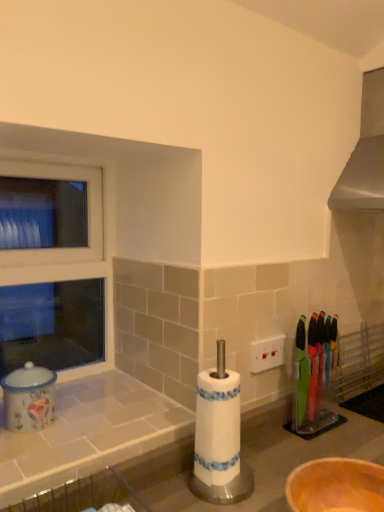
Measure the distance between white tile counter at lower left and camera.

The distance of white tile counter at lower left from camera is 29.96 inches.

What is the approximate width of wooden bowl at lower right?

7.51 inches.

Measure the distance between matte ceramic coffee canister at left and camera.

matte ceramic coffee canister at left is 37.74 inches away from camera.

Locate an element on the screen. The height and width of the screenshot is (512, 384). translucent plastic knives at right is located at coordinates (309, 382).

Identify the location of white tile counter at lower left. (88, 433).

Is matte ceramic coffee canister at left in contact with white tile counter at lower left?

No, matte ceramic coffee canister at left is not making contact with white tile counter at lower left.

Considering the relative sizes of matte ceramic coffee canister at left and white tile counter at lower left in the image provided, is matte ceramic coffee canister at left wider than white tile counter at lower left?

No, matte ceramic coffee canister at left is not wider than white tile counter at lower left.

Does matte ceramic coffee canister at left appear on the right side of white tile counter at lower left?

No.

The height and width of the screenshot is (512, 384). In order to click on appliance above the white tile counter at lower left (from the image's perspective) in this screenshot , I will do `click(29, 398)`.

I want to click on bowl on the left of translucent plastic knives at right, so click(x=336, y=486).

Is wooden bowl at lower right next to translucent plastic knives at right and touching it?

There is a gap between wooden bowl at lower right and translucent plastic knives at right.

Does wooden bowl at lower right lie in front of translucent plastic knives at right?

Yes, wooden bowl at lower right is in front of translucent plastic knives at right.

Is wooden bowl at lower right facing away from translucent plastic knives at right?

No, wooden bowl at lower right is not facing away from translucent plastic knives at right.

From their relative heights in the image, would you say translucent plastic knives at right is taller or shorter than matte ceramic coffee canister at left?

Considering their sizes, translucent plastic knives at right has more height than matte ceramic coffee canister at left.

From the image's perspective, which one is positioned lower, translucent plastic knives at right or matte ceramic coffee canister at left?

matte ceramic coffee canister at left appears lower in the image.

In the image, is translucent plastic knives at right positioned in front of or behind matte ceramic coffee canister at left?

Clearly, translucent plastic knives at right is behind matte ceramic coffee canister at left.

Does translucent plastic knives at right appear on the right side of matte ceramic coffee canister at left?

Correct, you'll find translucent plastic knives at right to the right of matte ceramic coffee canister at left.

Which of these two, translucent plastic knives at right or white tile counter at lower left, is bigger?

white tile counter at lower left is bigger.

From a real-world perspective, between translucent plastic knives at right and white tile counter at lower left, who is vertically higher?

In real-world perspective, translucent plastic knives at right is above.

Which of these two, translucent plastic knives at right or white tile counter at lower left, stands shorter?

With less height is white tile counter at lower left.

Is translucent plastic knives at right inside the boundaries of white tile counter at lower left, or outside?

translucent plastic knives at right is not inside white tile counter at lower left, it's outside.

Which is behind, wooden bowl at lower right or matte ceramic coffee canister at left?

matte ceramic coffee canister at left is further away from the camera.

Is point (382, 504) less distant than point (16, 420)?

Yes, it is in front of point (16, 420).

From a real-world perspective, is wooden bowl at lower right physically below matte ceramic coffee canister at left?

Yes, from a real-world perspective, wooden bowl at lower right is under matte ceramic coffee canister at left.

Which object is wider, wooden bowl at lower right or matte ceramic coffee canister at left?

wooden bowl at lower right.

Looking at this image, which object is positioned more to the right, translucent plastic knives at right or wooden bowl at lower right?

translucent plastic knives at right.

Which object is thinner, translucent plastic knives at right or wooden bowl at lower right?

With smaller width is translucent plastic knives at right.

In the scene shown: Is wooden bowl at lower right at the back of translucent plastic knives at right?

That's not correct — translucent plastic knives at right is not looking away from wooden bowl at lower right.

From a real-world perspective, is wooden bowl at lower right under white tile counter at lower left?

Correct, in the physical world, wooden bowl at lower right is lower than white tile counter at lower left.

Based on the photo, in the image, is wooden bowl at lower right on the left side or the right side of white tile counter at lower left?

wooden bowl at lower right is to the right of white tile counter at lower left.

Between wooden bowl at lower right and white tile counter at lower left, which one has larger width?

white tile counter at lower left.

Looking at this image, from the image's perspective, which is above, wooden bowl at lower right or white tile counter at lower left?

white tile counter at lower left appears higher in the image.

The width and height of the screenshot is (384, 512). What are the coordinates of `appliance behind the white tile counter at lower left` in the screenshot? It's located at (29, 398).

At what (x,y) coordinates should I click in order to perform the action: click on tableware that is on the right side of wooden bowl at lower right. Please return your answer as a coordinate pair (x, y). The height and width of the screenshot is (512, 384). Looking at the image, I should click on (309, 382).

When comparing their distances from wooden bowl at lower right, does matte ceramic coffee canister at left or translucent plastic knives at right seem further?

matte ceramic coffee canister at left is further to wooden bowl at lower right.

Considering their positions, is wooden bowl at lower right positioned further to matte ceramic coffee canister at left than translucent plastic knives at right?

Result: translucent plastic knives at right is further to matte ceramic coffee canister at left.

Which object lies nearer to the anchor point wooden bowl at lower right, white tile counter at lower left or translucent plastic knives at right?

Among the two, translucent plastic knives at right is located nearer to wooden bowl at lower right.

When comparing their distances from white tile counter at lower left, does matte ceramic coffee canister at left or translucent plastic knives at right seem further?

translucent plastic knives at right.

Estimate the real-world distances between objects in this image. Which object is closer to wooden bowl at lower right, matte ceramic coffee canister at left or white tile counter at lower left?

white tile counter at lower left is positioned closer to the anchor wooden bowl at lower right.

Estimate the real-world distances between objects in this image. Which object is further from translucent plastic knives at right, matte ceramic coffee canister at left or wooden bowl at lower right?

matte ceramic coffee canister at left is positioned further to the anchor translucent plastic knives at right.

Looking at this image, estimate the real-world distances between objects in this image. Which object is closer to matte ceramic coffee canister at left, translucent plastic knives at right or wooden bowl at lower right?

The object closer to matte ceramic coffee canister at left is wooden bowl at lower right.

Based on their spatial positions, is wooden bowl at lower right or white tile counter at lower left closer to translucent plastic knives at right?

Based on the image, wooden bowl at lower right appears to be nearer to translucent plastic knives at right.

Find the location of a particular element. counter top situated between matte ceramic coffee canister at left and translucent plastic knives at right from left to right is located at coordinates (88, 433).

Where is `bowl between matte ceramic coffee canister at left and translucent plastic knives at right from left to right`? bowl between matte ceramic coffee canister at left and translucent plastic knives at right from left to right is located at coordinates pos(336,486).

Where is `counter top located between matte ceramic coffee canister at left and wooden bowl at lower right in the left-right direction`? The height and width of the screenshot is (512, 384). counter top located between matte ceramic coffee canister at left and wooden bowl at lower right in the left-right direction is located at coordinates (88, 433).

You are a GUI agent. You are given a task and a screenshot of the screen. Output one action in this format:
    pyautogui.click(x=<x>, y=<y>)
    Task: Click on the bowl situated between white tile counter at lower left and translucent plastic knives at right from left to right
    
    Given the screenshot: What is the action you would take?
    pyautogui.click(x=336, y=486)